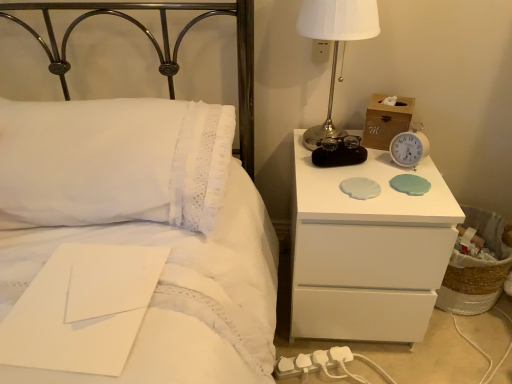
You are a GUI agent. You are given a task and a screenshot of the screen. Output one action in this format:
    pyautogui.click(x=<x>, y=<y>)
    Task: Click on the free location in front of white plastic alarm clock at upper right, the 2th alarm clock viewed from the left
    The width and height of the screenshot is (512, 384).
    Given the screenshot: What is the action you would take?
    pyautogui.click(x=411, y=196)